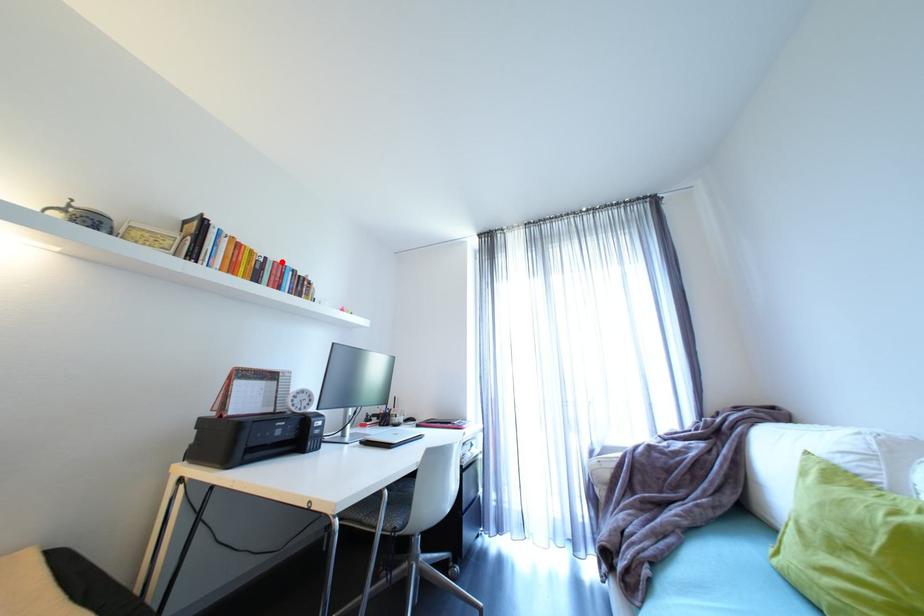
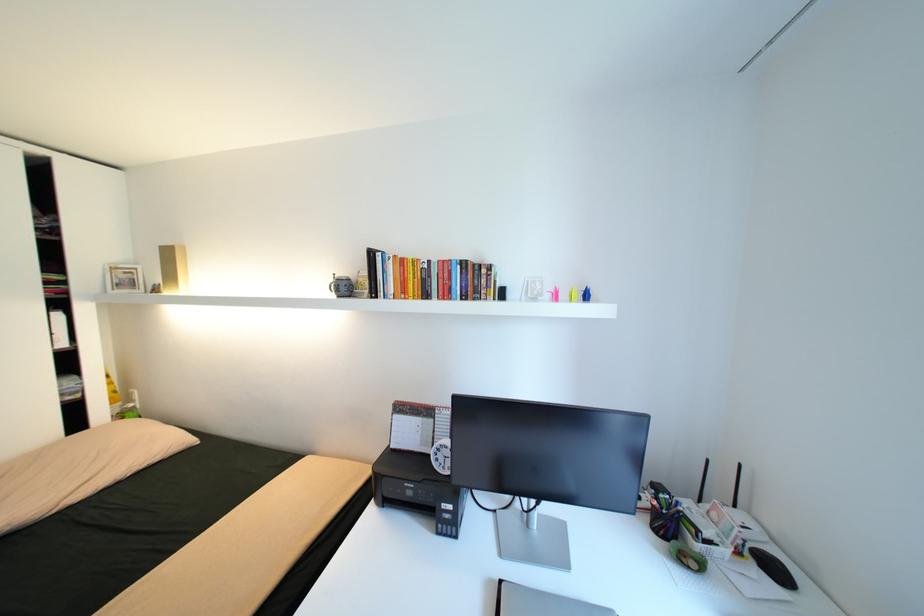
Locate, in the second image, the point that corresponds to the highlighted location in the first image.

(445, 262)